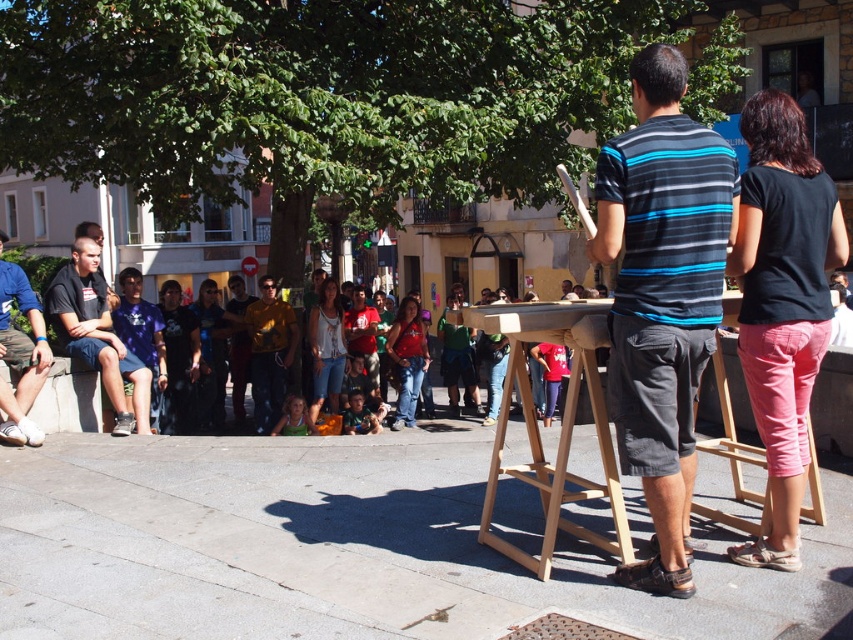
Can you confirm if yellow t-shirt at center is bigger than matte black shirt at center?

Incorrect, yellow t-shirt at center is not larger than matte black shirt at center.

Does yellow t-shirt at center have a lesser width compared to matte black shirt at center?

No.

You are a GUI agent. You are given a task and a screenshot of the screen. Output one action in this format:
    pyautogui.click(x=<x>, y=<y>)
    Task: Click on the yellow t-shirt at center
    The width and height of the screenshot is (853, 640).
    Given the screenshot: What is the action you would take?
    pyautogui.click(x=270, y=353)

I want to click on yellow t-shirt at center, so click(270, 353).

Describe the element at coordinates (560, 422) in the screenshot. The image size is (853, 640). I see `wooden easel at center` at that location.

Does wooden easel at center have a greater width compared to matte black shirt at center?

Correct, the width of wooden easel at center exceeds that of matte black shirt at center.

At what (x,y) coordinates should I click in order to perform the action: click on wooden easel at center. Please return your answer as a coordinate pair (x, y). This screenshot has height=640, width=853. Looking at the image, I should click on (560, 422).

From the picture: Who is positioned more to the left, gray concrete pavement at center or matte black shorts at left?

matte black shorts at left is more to the left.

Which is in front, point (303, 621) or point (12, 424)?

Point (303, 621) is more forward.

Locate an element on the screen. The width and height of the screenshot is (853, 640). gray concrete pavement at center is located at coordinates (338, 548).